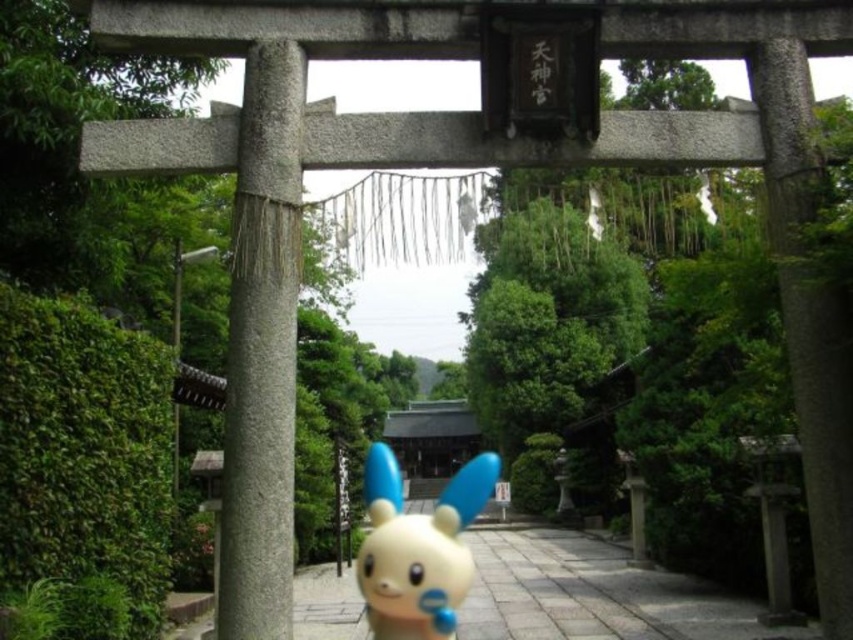
Does gray stone pillar at left lie behind white matte toy at center?

No, gray stone pillar at left is in front of white matte toy at center.

Which is above, gray stone pillar at left or white matte toy at center?

gray stone pillar at left is higher up.

Find the location of a particular element. The width and height of the screenshot is (853, 640). gray stone pillar at left is located at coordinates [262, 349].

Identify the location of white matte toy at center. (595, 593).

Is white matte toy at center positioned before yellow matte toy at center?

No, white matte toy at center is behind yellow matte toy at center.

What are the coordinates of `white matte toy at center` in the screenshot? It's located at (595, 593).

Identify the location of white matte toy at center. (595, 593).

Does gray stone pillar at left have a greater height compared to yellow matte toy at center?

Incorrect, gray stone pillar at left's height is not larger of yellow matte toy at center's.

The image size is (853, 640). Find the location of `gray stone pillar at left`. gray stone pillar at left is located at coordinates (262, 349).

Between point (299, 161) and point (370, 577), which one is positioned behind?

The point (299, 161) is more distant.

You are a GUI agent. You are given a task and a screenshot of the screen. Output one action in this format:
    pyautogui.click(x=<x>, y=<y>)
    Task: Click on the gray stone pillar at left
    The image size is (853, 640).
    Given the screenshot: What is the action you would take?
    [262, 349]